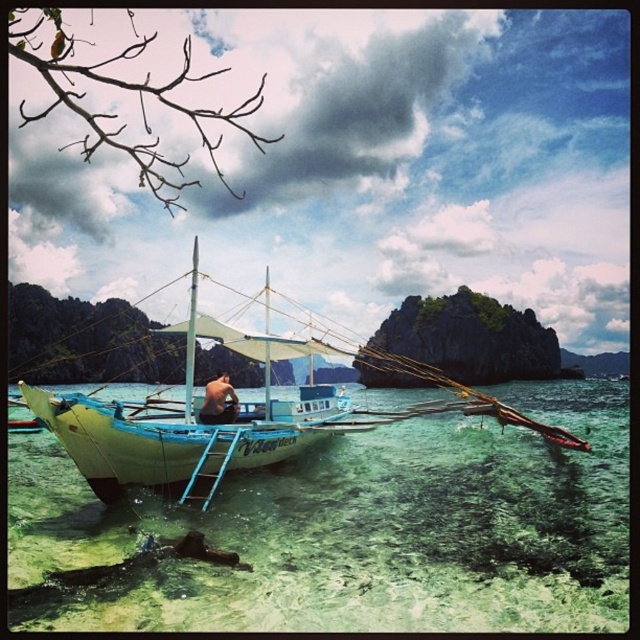
You are a tour guide planning a guided walk along the coastal path. You need to ensure that your group can hear you clearly while you explain the significance of the light blue wooden boat at center and the skinny man at center. Considering the distance between them, what is the maximum distance your group should stay from you to ensure everyone can hear?

The light blue wooden boat at center and the skinny man at center are 21.10 meters apart. To ensure the group can hear clearly, they should stay within 20 meters of you as the distance between the two objects is just over 20 meters, so staying closer ensures audibility.